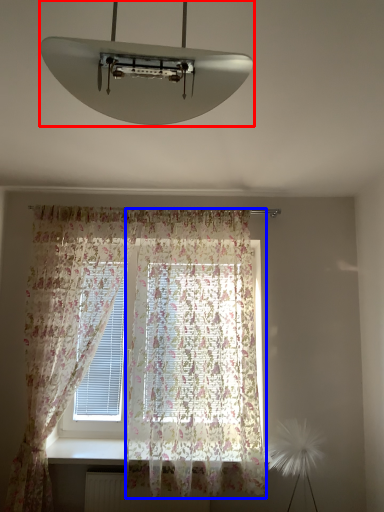
Question: Which object appears closest to the camera in this image, lamp (highlighted by a red box) or curtain (highlighted by a blue box)?

Choices:
 (A) lamp
 (B) curtain

Answer: (A)